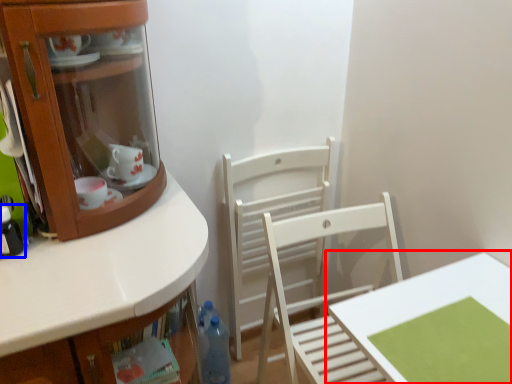
Question: Among these objects, which one is nearest to the camera, table (highlighted by a red box) or bottle (highlighted by a blue box)?

Choices:
 (A) table
 (B) bottle

Answer: (A)